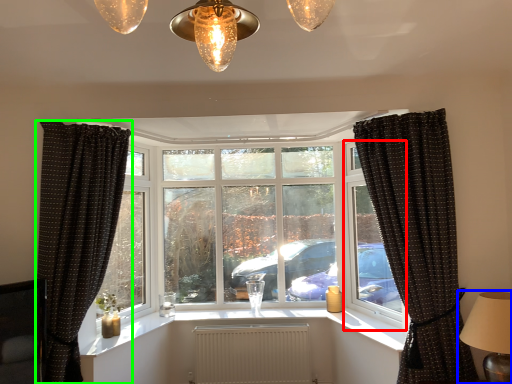
Question: Based on their relative distances, which object is farther from window frame (highlighted by a red box)? Choose from table lamp (highlighted by a blue box) and curtain (highlighted by a green box).

Choices:
 (A) table lamp
 (B) curtain

Answer: (B)